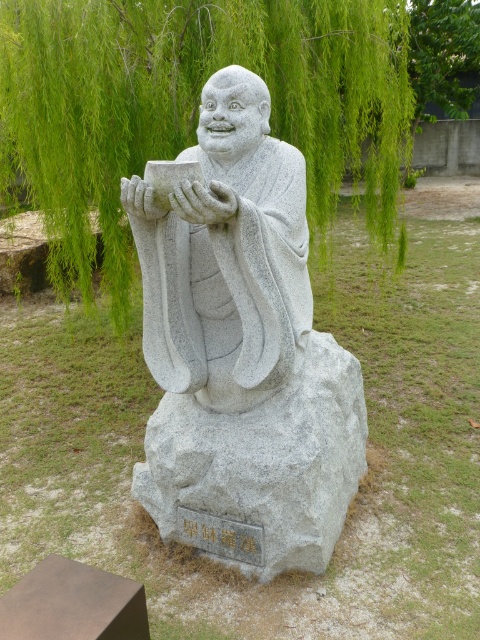
Question: Which point is closer to the camera?

Choices:
 (A) (472, 44)
 (B) (249, 3)
 (C) (214, 148)

Answer: (C)

Question: Is gray stone statue at center positioned at the back of green leafy tree at upper center?

Choices:
 (A) yes
 (B) no

Answer: (B)

Question: Is gray stone statue at center below green leafy willow at upper center?

Choices:
 (A) no
 (B) yes

Answer: (B)

Question: Which of the following is the closest to the observer?

Choices:
 (A) gray stone statue at center
 (B) green leafy tree at upper center

Answer: (A)

Question: Which object appears farthest from the camera in this image?

Choices:
 (A) green leafy tree at upper center
 (B) green leafy willow at upper center

Answer: (A)

Question: Does gray stone statue at center have a smaller size compared to green leafy willow at upper center?

Choices:
 (A) no
 (B) yes

Answer: (B)